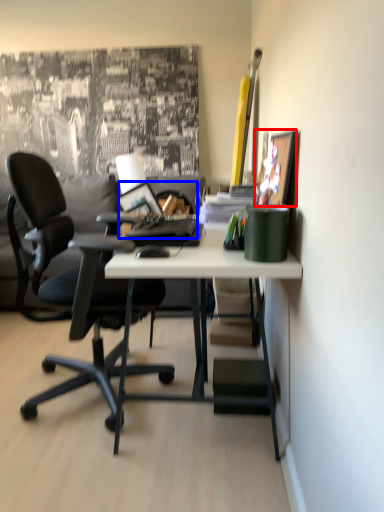
Question: Which object appears closest to the camera in this image, picture frame (highlighted by a red box) or laptop (highlighted by a blue box)?

Choices:
 (A) picture frame
 (B) laptop

Answer: (A)